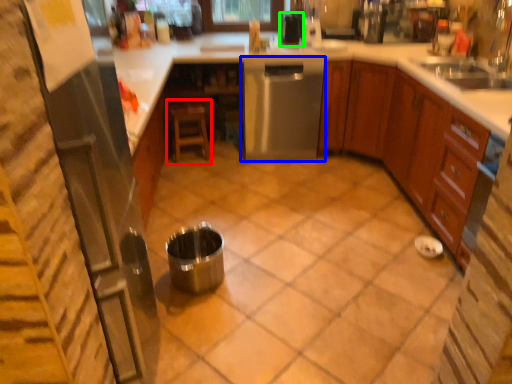
Question: Based on their relative distances, which object is nearer to stool (highlighted by a red box)? Choose from home appliance (highlighted by a blue box) and appliance (highlighted by a green box).

Choices:
 (A) home appliance
 (B) appliance

Answer: (A)